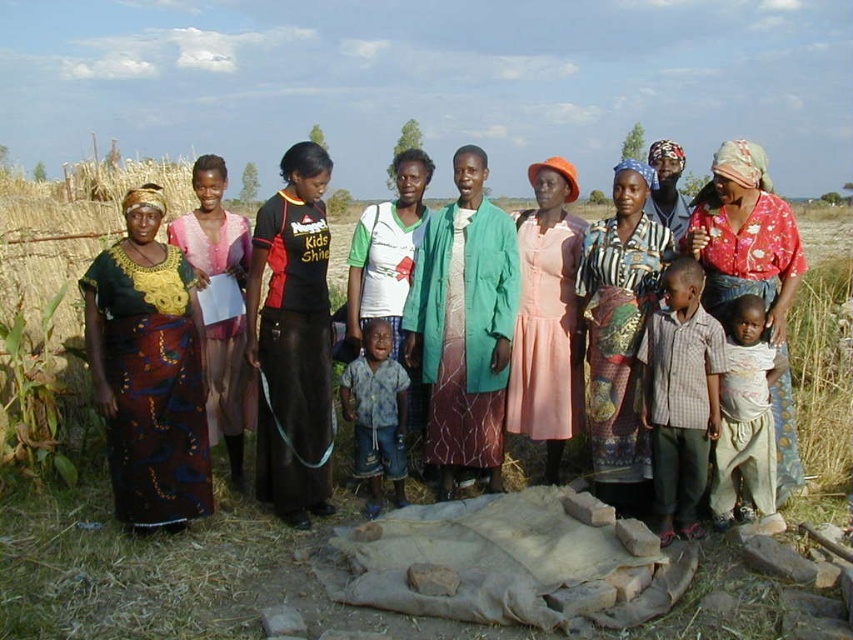
You are a photographer trying to capture a group photo of the scene. The camera is positioned at point A, and you want to ensure that the black matte skirt at center is visible in the frame. What is the minimum distance you should move the camera backward from point A to include the entire skirt in the shot?

The black matte skirt at center is positioned at point (x=292, y=339). To include the entire skirt in the frame, you need to move the camera backward by at least 2 meters to ensure proper framing and depth of field.

You are a photographer trying to capture a candid shot of the group. You notice the black matte skirt at center and the blue denim shorts at center. Which one is positioned to the left in the scene?

The black matte skirt at center is positioned to the left of the blue denim shorts at center.

You are a photographer trying to capture a clear shot of the black matte skirt at center without the dark brown woven fabric at left showing in the background. Is this possible given their positions?

The dark brown woven fabric at left is positioned under the black matte skirt at center, so it is possible to capture a clear shot of the black matte skirt at center without the dark brown woven fabric at left showing in the background since the fabric is beneath it and not behind.